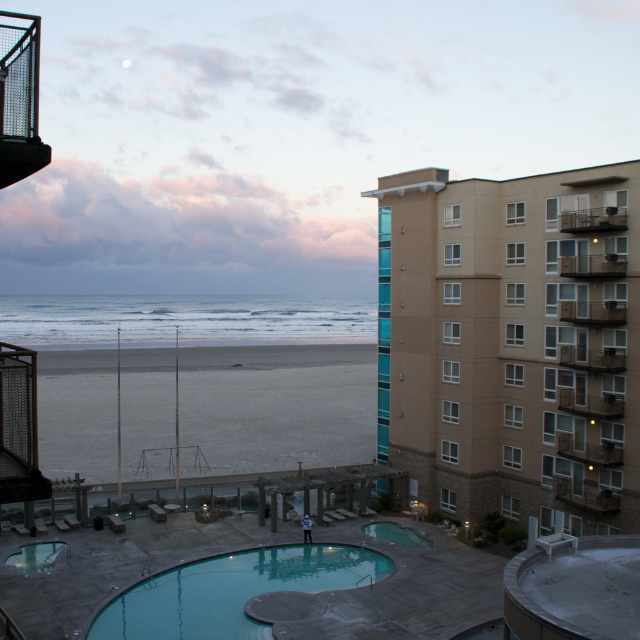
Can you confirm if beige concrete building at right is positioned below gray sand at lower left?

Incorrect, beige concrete building at right is not positioned below gray sand at lower left.

Is beige concrete building at right further to the viewer compared to gray sand at lower left?

No, it is in front of gray sand at lower left.

Find the location of `beige concrete building at right`. beige concrete building at right is located at coordinates (509, 346).

Between teal glossy pool at center and clear glass pool at lower left, which one has less height?

Standing shorter between the two is clear glass pool at lower left.

Which of these two, teal glossy pool at center or clear glass pool at lower left, stands taller?

teal glossy pool at center is taller.

Between point (186, 621) and point (20, 568), which one is positioned behind?

The point (20, 568) is more distant.

Where is `teal glossy pool at center`? The height and width of the screenshot is (640, 640). teal glossy pool at center is located at coordinates (230, 589).

From the picture: Does beige concrete building at right appear under clear glass pool at lower left?

Incorrect, beige concrete building at right is not positioned below clear glass pool at lower left.

Is beige concrete building at right wider than clear glass pool at lower left?

Indeed, beige concrete building at right has a greater width compared to clear glass pool at lower left.

Is point (628, 180) closer to camera compared to point (54, 557)?

Yes.

At what (x,y) coordinates should I click in order to perform the action: click on beige concrete building at right. Please return your answer as a coordinate pair (x, y). Looking at the image, I should click on click(509, 346).